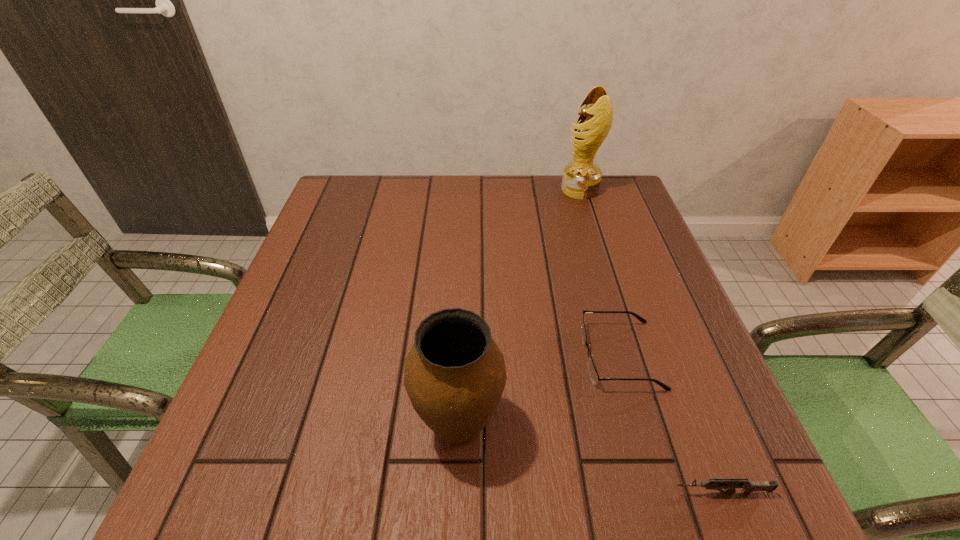
At what (x,y) coordinates should I click in order to perform the action: click on gun that is at the right edge. Please return your answer as a coordinate pair (x, y). Image resolution: width=960 pixels, height=540 pixels. Looking at the image, I should click on (748, 486).

The width and height of the screenshot is (960, 540). I want to click on spectacles that is at the right edge, so click(593, 373).

This screenshot has width=960, height=540. In order to click on object that is at the far right corner in this screenshot , I will do `click(581, 179)`.

Identify the location of object present at the near right corner. (748, 486).

This screenshot has width=960, height=540. In order to click on vacant space at the far edge of the desktop in this screenshot , I will do (x=547, y=188).

In the image, there is a desktop. Identify the location of free space at the near edge. (366, 500).

This screenshot has height=540, width=960. What are the coordinates of `free space at the left edge of the desktop` in the screenshot? It's located at (342, 242).

In the image, there is a desktop. Where is `free space at the right edge`? This screenshot has width=960, height=540. free space at the right edge is located at coordinates (631, 305).

Where is `vacant area at the far left corner`? The width and height of the screenshot is (960, 540). vacant area at the far left corner is located at coordinates (340, 174).

This screenshot has width=960, height=540. In the image, there is a desktop. In order to click on blank space at the near left corner in this screenshot , I will do `click(220, 498)`.